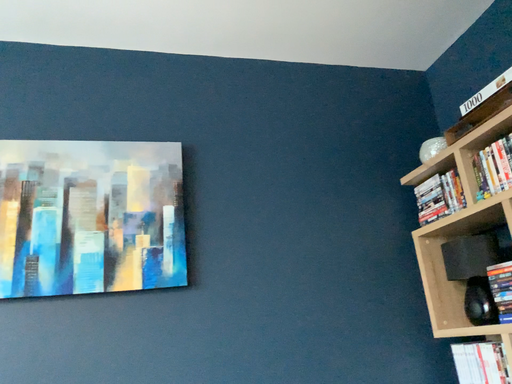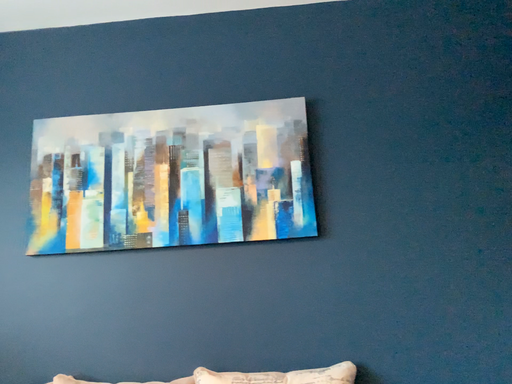
Question: Which way did the camera rotate in the video?

Choices:
 (A) rotated right
 (B) rotated left

Answer: (B)